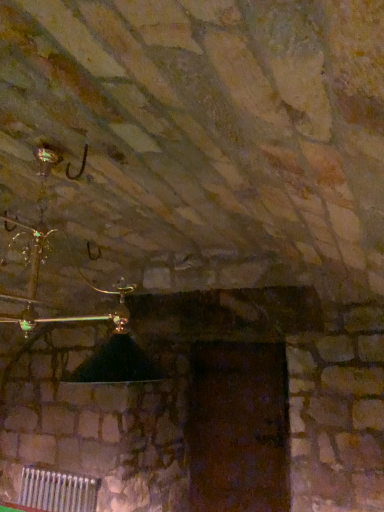
You are a GUI agent. You are given a task and a screenshot of the screen. Output one action in this format:
    pyautogui.click(x=<x>, y=<y>)
    Task: Click on the silver metallic radiator at lower left
    This screenshot has width=384, height=512.
    Given the screenshot: What is the action you would take?
    pyautogui.click(x=57, y=490)

Describe the element at coordinates (57, 490) in the screenshot. The width and height of the screenshot is (384, 512). I see `silver metallic radiator at lower left` at that location.

Locate an element on the screen. silver metallic radiator at lower left is located at coordinates point(57,490).